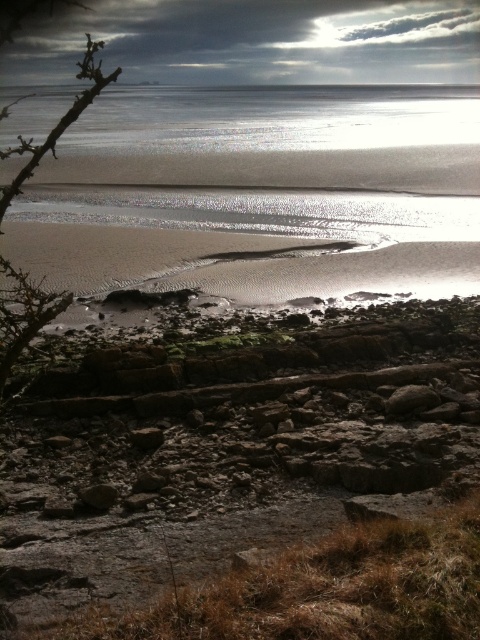
Is point (314, 99) less distant than point (2, 384)?

No.

Is shiny metallic water at upper center to the right of brown thorny branch at left from the viewer's perspective?

Indeed, shiny metallic water at upper center is positioned on the right side of brown thorny branch at left.

Is point (162, 116) less distant than point (96, 67)?

Yes, it is in front of point (96, 67).

You are a GUI agent. You are given a task and a screenshot of the screen. Output one action in this format:
    pyautogui.click(x=<x>, y=<y>)
    Task: Click on the shiny metallic water at upper center
    The width and height of the screenshot is (480, 640).
    Given the screenshot: What is the action you would take?
    pyautogui.click(x=276, y=138)